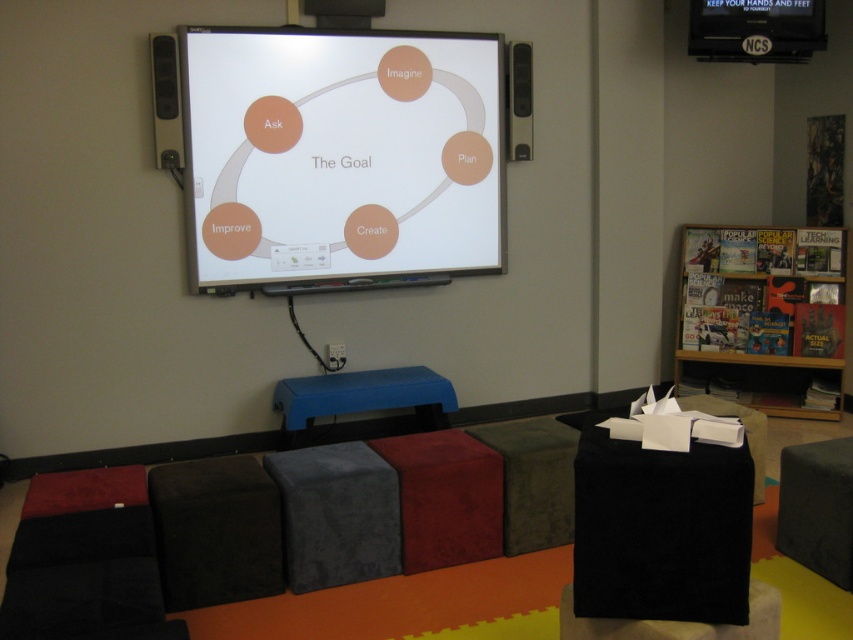
You are organizing a small workshop and need to seat two participants. You have a black fabric hassock at upper right and a blue rubber stool at center. Which seating option is wider?

The blue rubber stool at center is wider than the black fabric hassock at upper right.

Consider the image. You are standing in the room and want to locate the white glossy projection screen at upper center. According to the coordinates given, where should you look?

The white glossy projection screen at upper center is located at coordinates point (340, 154).